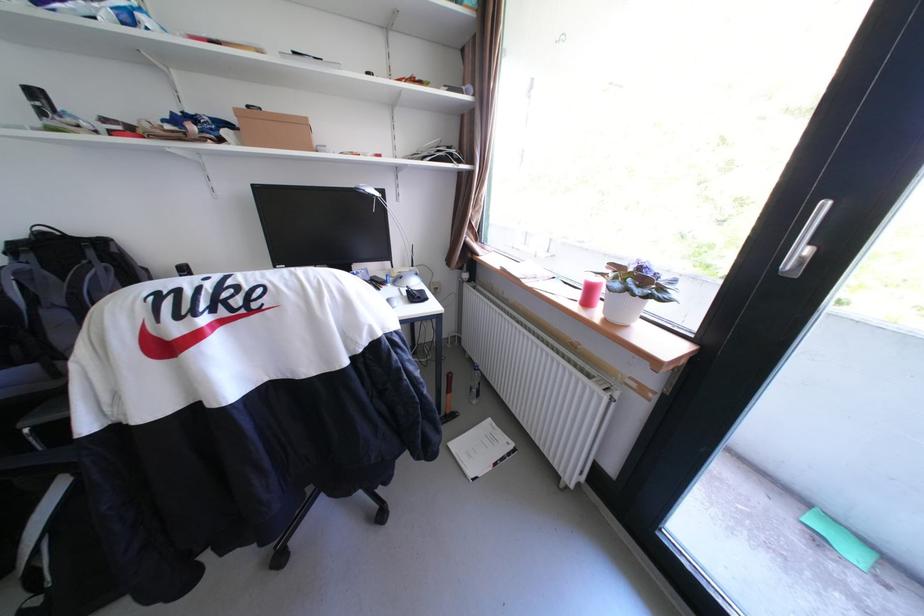
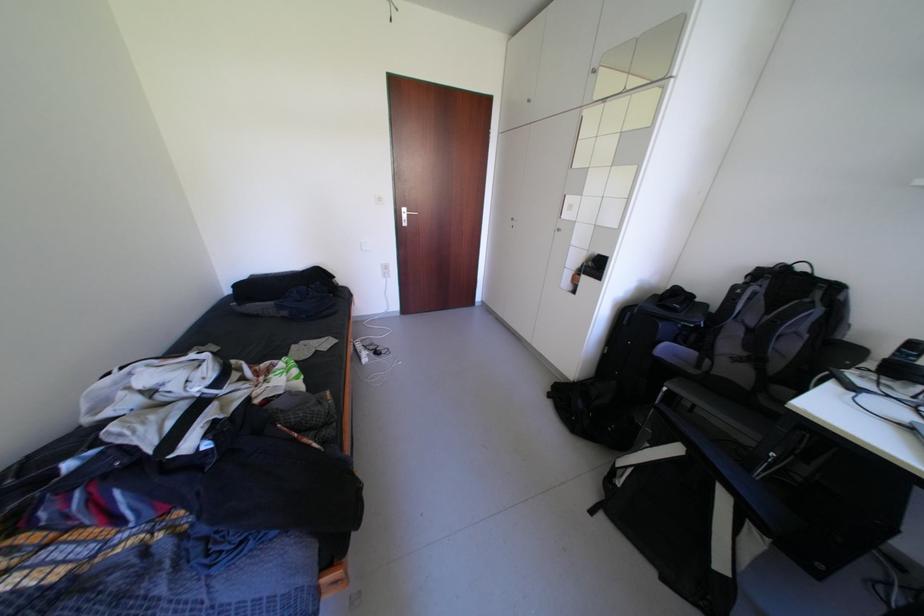
How did the camera likely rotate?

The camera rotated toward left-down.